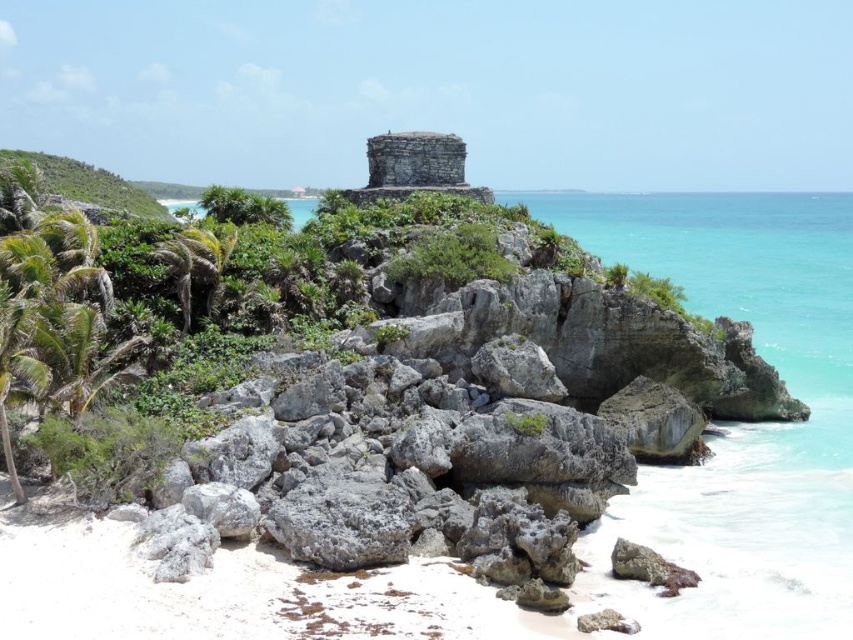
Question: Is the position of turquoise water at center less distant than that of green leafy palm tree at left?

Choices:
 (A) yes
 (B) no

Answer: (A)

Question: Among these objects, which one is farthest from the camera?

Choices:
 (A) green leafy palm tree at left
 (B) turquoise water at center

Answer: (A)

Question: Is turquoise water at center to the left of green leafy palm tree at left from the viewer's perspective?

Choices:
 (A) yes
 (B) no

Answer: (B)

Question: Can you confirm if turquoise water at center is positioned above green leafy palm tree at left?

Choices:
 (A) no
 (B) yes

Answer: (B)

Question: Which object appears closest to the camera in this image?

Choices:
 (A) turquoise water at center
 (B) green leafy palm tree at left

Answer: (A)